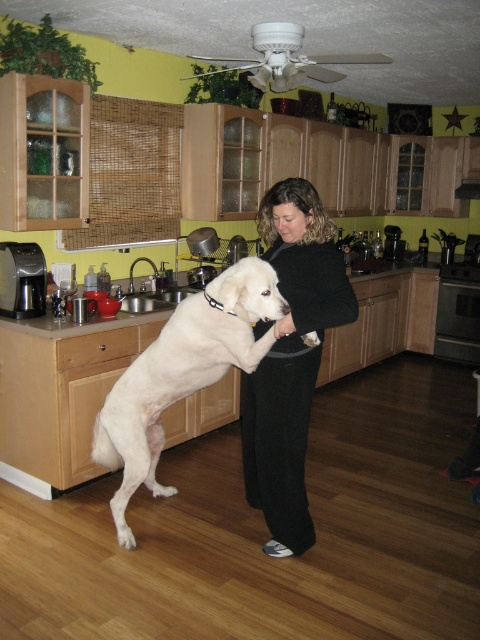
Consider the image. Who is positioned more to the left, black soft pants at center or white fluffy dog at center?

white fluffy dog at center

Is black soft pants at center thinner than white fluffy dog at center?

Correct, black soft pants at center's width is less than white fluffy dog at center's.

Which is in front, point (275, 436) or point (259, 300)?

Point (259, 300) is in front.

What are the coordinates of `black soft pants at center` in the screenshot? It's located at (290, 358).